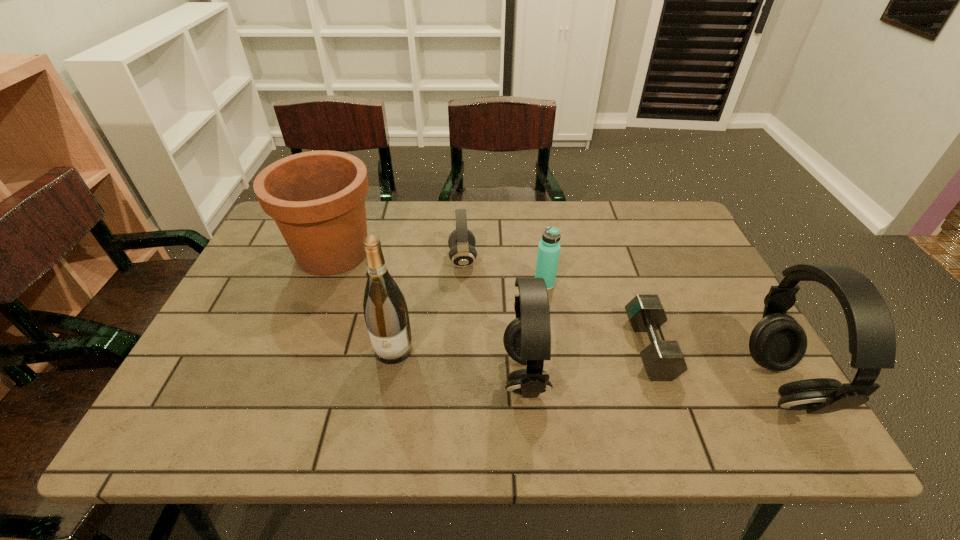
Where is `vacant region at the far right corner of the desktop`? This screenshot has width=960, height=540. vacant region at the far right corner of the desktop is located at coordinates (675, 230).

At what (x,y) coordinates should I click in order to perform the action: click on free space between the taller earphone and the thermos bottle. Please return your answer as a coordinate pair (x, y). This screenshot has height=540, width=960. Looking at the image, I should click on (661, 334).

Locate an element on the screen. The width and height of the screenshot is (960, 540). free space between the dumbbell and the flowerpot is located at coordinates (492, 300).

The height and width of the screenshot is (540, 960). What are the coordinates of `vacant space that's between the sixth object from right to left and the left earphone` in the screenshot? It's located at (459, 362).

Where is `free space between the dumbbell and the taller earphone`? The width and height of the screenshot is (960, 540). free space between the dumbbell and the taller earphone is located at coordinates (714, 366).

The width and height of the screenshot is (960, 540). Find the location of `empty space between the sixth tallest object and the dumbbell`. empty space between the sixth tallest object and the dumbbell is located at coordinates (556, 303).

You are a GUI agent. You are given a task and a screenshot of the screen. Output one action in this format:
    pyautogui.click(x=<x>, y=<y>)
    Task: Click on the free space between the shortest object and the second shortest object
    
    Given the screenshot: What is the action you would take?
    pyautogui.click(x=556, y=303)

This screenshot has height=540, width=960. I want to click on empty space that is in between the leftmost object and the thermos bottle, so click(x=439, y=268).

The height and width of the screenshot is (540, 960). I want to click on object that is the closest one to the taller earphone, so click(663, 360).

This screenshot has height=540, width=960. What are the coordinates of `the third closest object to the sixth tallest object` in the screenshot? It's located at (386, 315).